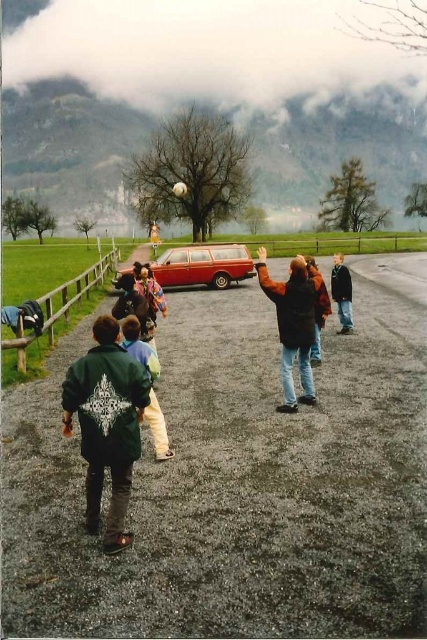
You are a photographer trying to capture a photo of the shiny red station wagon at center without including the brown leather jacket at center in the frame. Is it possible to do so based on their sizes?

The brown leather jacket at center is much taller than the shiny red station wagon at center. Since the jacket is taller, it might block the view of the station wagon if positioned directly in front. However, if the station wagon is positioned behind the jacket or to the side, it could still be captured without the jacket in the frame depending on their arrangement. But according to the description, the jacket is at the center and much taller, so it might be challenging to avoid including it unless the car.

You are a photographer trying to capture a photo of the green fuzzy jacket at lower left and the shiny red station wagon at center. Which object should you focus on first if you want to ensure both are in focus without adjusting your camera settings?

The green fuzzy jacket at lower left is taller than the shiny red station wagon at center, so focusing on the green fuzzy jacket at lower left first would help ensure both are in focus since it is larger in the frame.

You are standing at the center of the parking area and want to locate the green fuzzy jacket at lower left. According to the coordinates provided, which direction should you face to see it?

The green fuzzy jacket at lower left is located at coordinates point (107, 424), so you should face towards the lower left direction to see it.